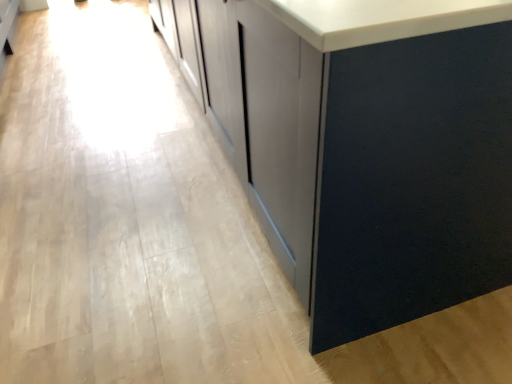
Question: Should I look upward or downward to see matte gray cabinet at center?

Choices:
 (A) up
 (B) down

Answer: (A)